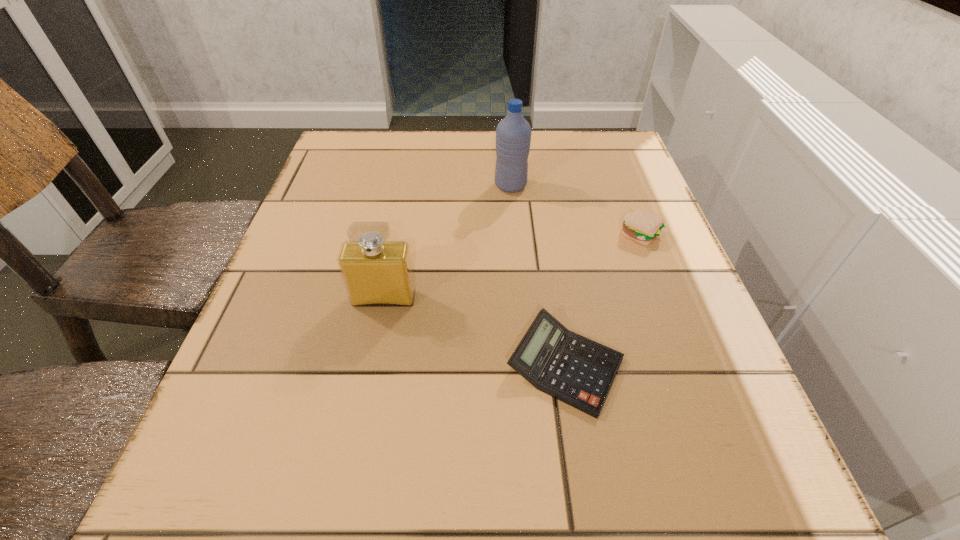
This screenshot has width=960, height=540. Identify the location of empty location between the calculator and the tallest object. (538, 276).

The height and width of the screenshot is (540, 960). In order to click on free spot between the nearest object and the tallest object in this screenshot , I will do `click(538, 276)`.

You are a GUI agent. You are given a task and a screenshot of the screen. Output one action in this format:
    pyautogui.click(x=<x>, y=<y>)
    Task: Click on the object that is the closest to the third shortest object
    This screenshot has width=960, height=540.
    Given the screenshot: What is the action you would take?
    pyautogui.click(x=578, y=371)

Where is `object identified as the closest to the patty`? This screenshot has width=960, height=540. object identified as the closest to the patty is located at coordinates (578, 371).

Identify the location of blank area in the image that satisfies the following two spatial constraints: 1. on the front-facing side of the nearest object; 2. on the right side of the third shortest object. (371, 366).

Where is `free space that satisfies the following two spatial constraints: 1. on the front side of the rightmost object; 2. on the left side of the tallest object`? free space that satisfies the following two spatial constraints: 1. on the front side of the rightmost object; 2. on the left side of the tallest object is located at coordinates (515, 234).

Where is `vacant space that satisfies the following two spatial constraints: 1. on the front-facing side of the perfume; 2. on the right side of the nearest object`? This screenshot has width=960, height=540. vacant space that satisfies the following two spatial constraints: 1. on the front-facing side of the perfume; 2. on the right side of the nearest object is located at coordinates (371, 366).

Identify the location of vacant area that satisfies the following two spatial constraints: 1. on the back side of the second farthest object; 2. on the right side of the calculator. (544, 234).

Locate an element on the screen. vacant point that satisfies the following two spatial constraints: 1. on the front-facing side of the leftmost object; 2. on the left side of the nearest object is located at coordinates (371, 366).